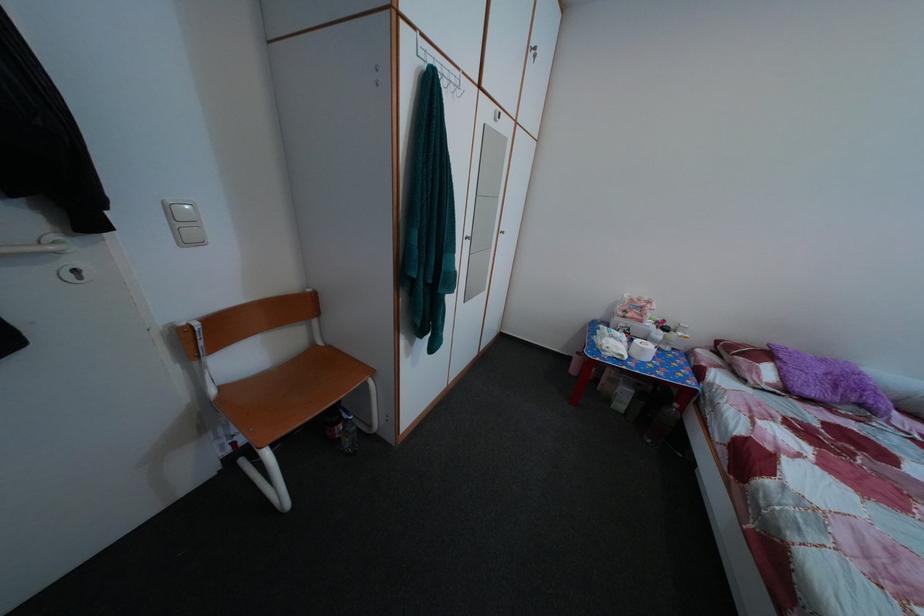
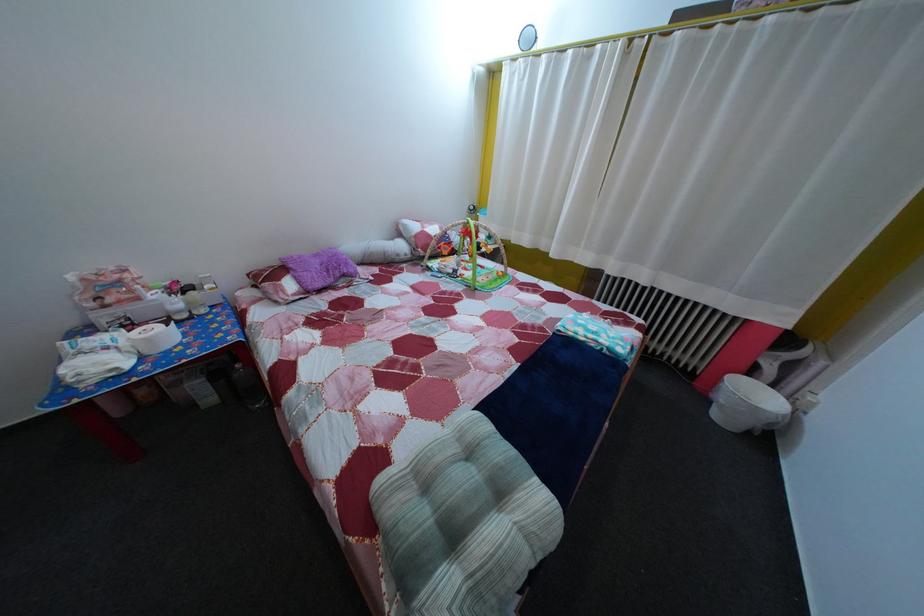
Locate, in the second image, the point that corresponds to [686,413] in the first image.

(248, 374)